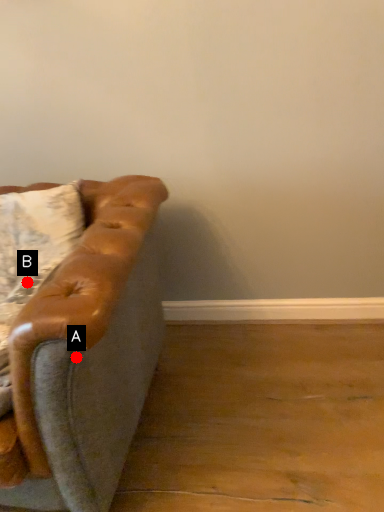
Question: Two points are circled on the image, labeled by A and B beside each circle. Which point appears farthest from the camera in this image?

Choices:
 (A) A is further
 (B) B is further

Answer: (B)